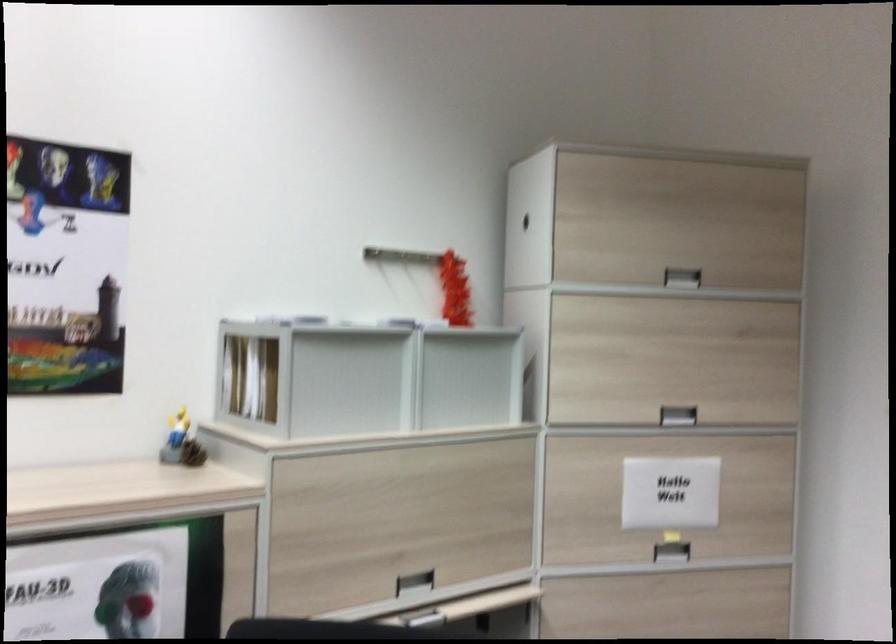
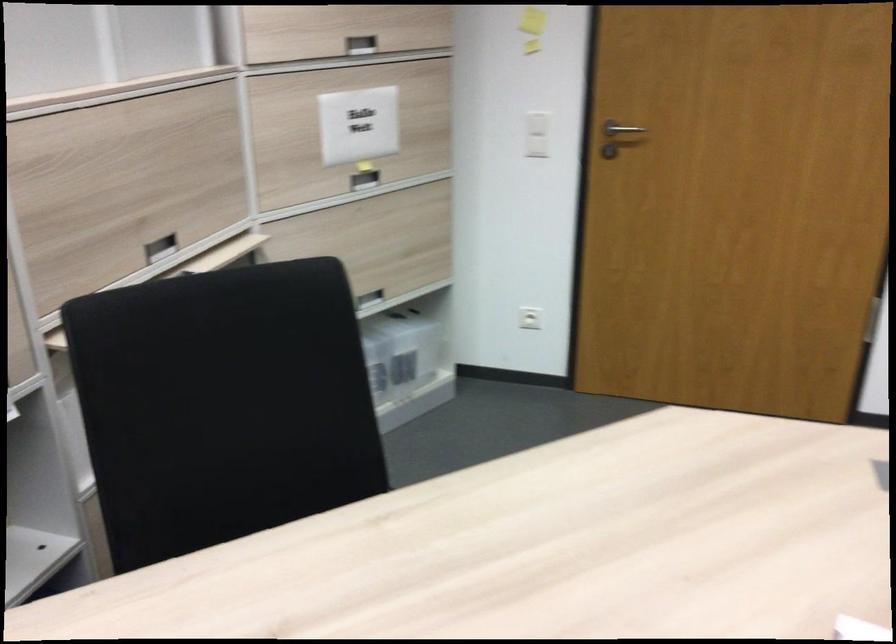
Where in the second image is the point corresponding to point 684,412 from the first image?

(360, 44)